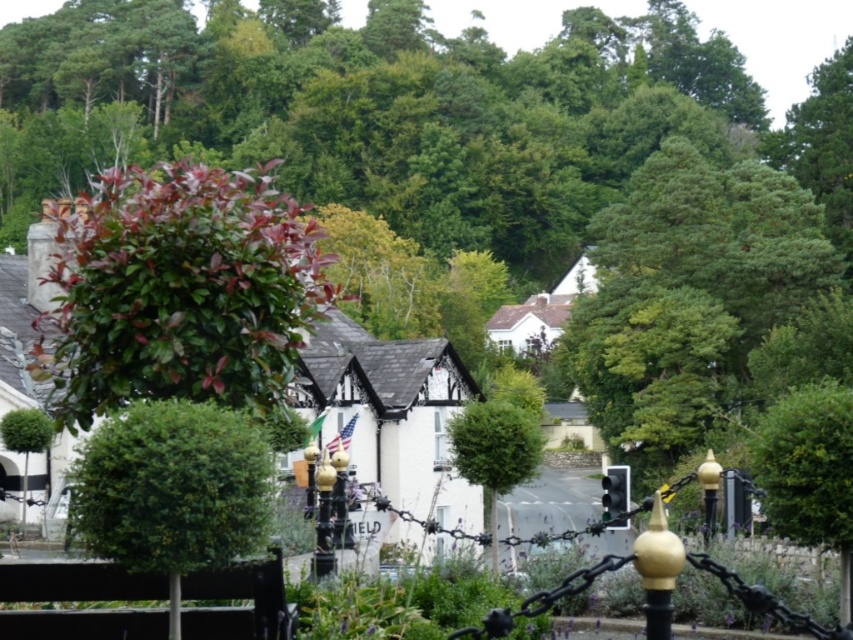
Question: Which object is closer to the camera taking this photo?

Choices:
 (A) green glossy tree at upper left
 (B) green leafy bush at center

Answer: (A)

Question: Which is farther from the green leafy bush at center?

Choices:
 (A) green glossy tree at left
 (B) green glossy tree at upper left

Answer: (B)

Question: Does green glossy tree at upper left have a larger size compared to green leafy bush at center?

Choices:
 (A) no
 (B) yes

Answer: (B)

Question: Which object is farther from the camera taking this photo?

Choices:
 (A) green leafy bush at center
 (B) green glossy tree at left

Answer: (B)

Question: Can you confirm if green glossy tree at upper left is smaller than green glossy tree at left?

Choices:
 (A) no
 (B) yes

Answer: (A)

Question: Does green glossy tree at upper left appear on the left side of green glossy tree at left?

Choices:
 (A) no
 (B) yes

Answer: (B)